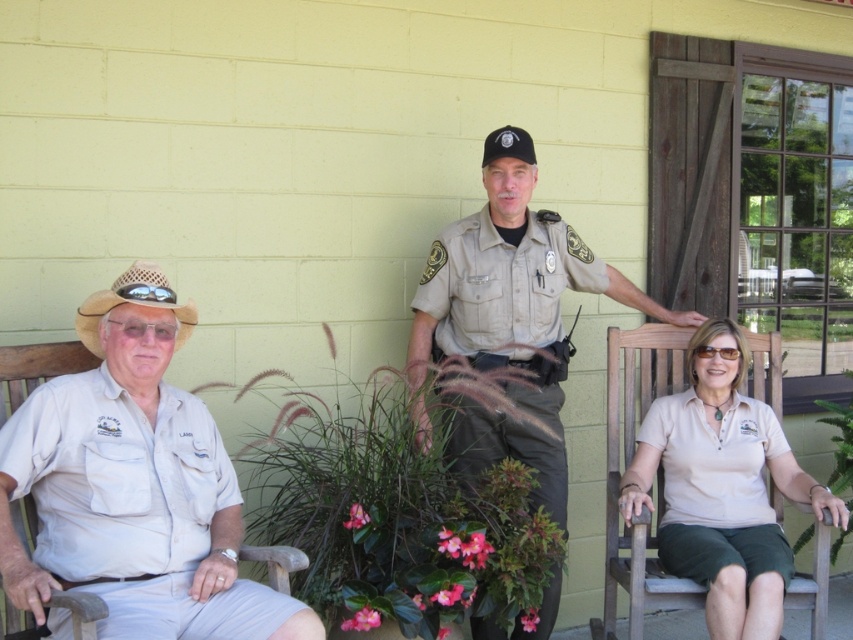
You are an observer standing in front of the scene. You notice the beige cotton shirt at lower right and the tan straw cowboy hat at left. Which object is taller?

The beige cotton shirt at lower right is taller than the tan straw cowboy hat at left according to the description.

You are organizing a charity event and need to display two beige shirts on a mannequin. The beige fabric shirt at center is larger than the beige cotton shirt at lower right. Which shirt should you place on the upper part of the mannequin to ensure proper display?

The beige fabric shirt at center should be placed on the upper part of the mannequin because it is larger in size than the beige cotton shirt at lower right, allowing it to be more visible from above.

Consider the image. You are a photographer trying to capture a candid shot of the tan uniform at center and the tan straw cowboy hat at left. Since you want to avoid making them aware of the camera, you decide to take the photo from a distance. Which object should you focus on first to ensure both are in frame?

The tan uniform at center is positioned under the tan straw cowboy hat at left, so you should focus on the tan straw cowboy hat at left first to ensure both are in frame.